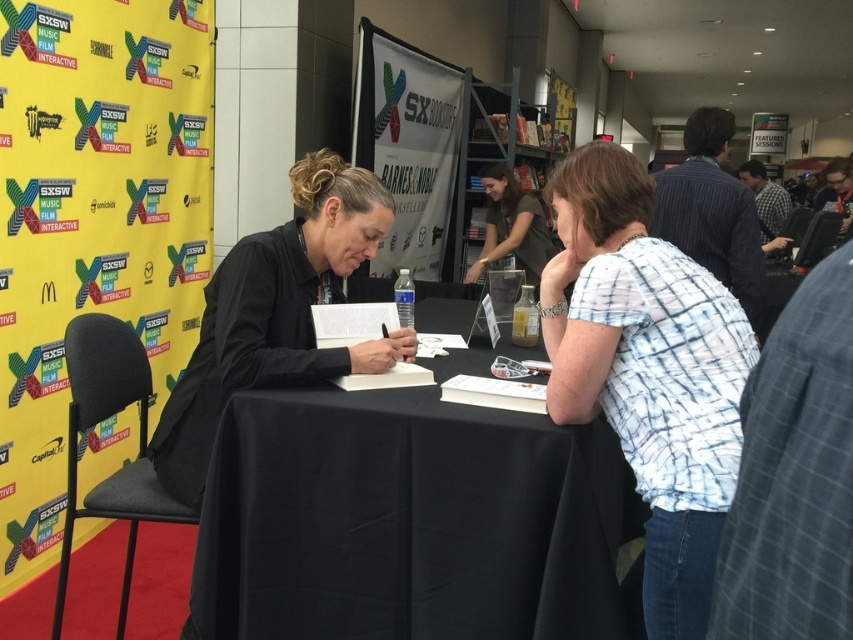
You are taking a photo of the book signing event at SXSW. You want to focus on the two points in the image located at coordinates point (331, 413) and point (306, 381). Which point should you focus on first to ensure the closest object is in sharp focus?

Point (331, 413) is closer to the camera than point (306, 381), so you should focus on point (331, 413) first to ensure the closest object is in sharp focus.

Consider the image. You are at the SXSW book signing event and need to move from the water bottle to the pen on the table. The water bottle is located at point (436, 420) and the pen is at point (495, 195). Which point should you move towards first to reach the pen?

You should move towards point (495, 195) first because it is the location of the pen you want to reach.